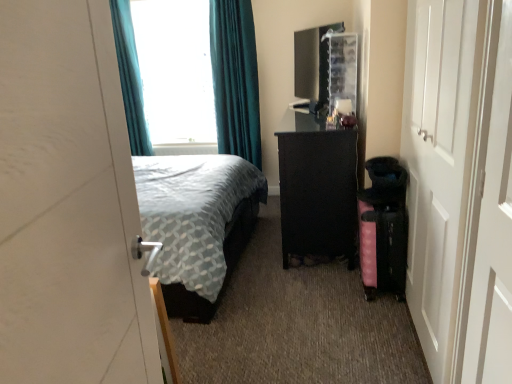
Locate an element on the screen. space that is in front of pink fabric suitcase at lower right is located at coordinates [375, 316].